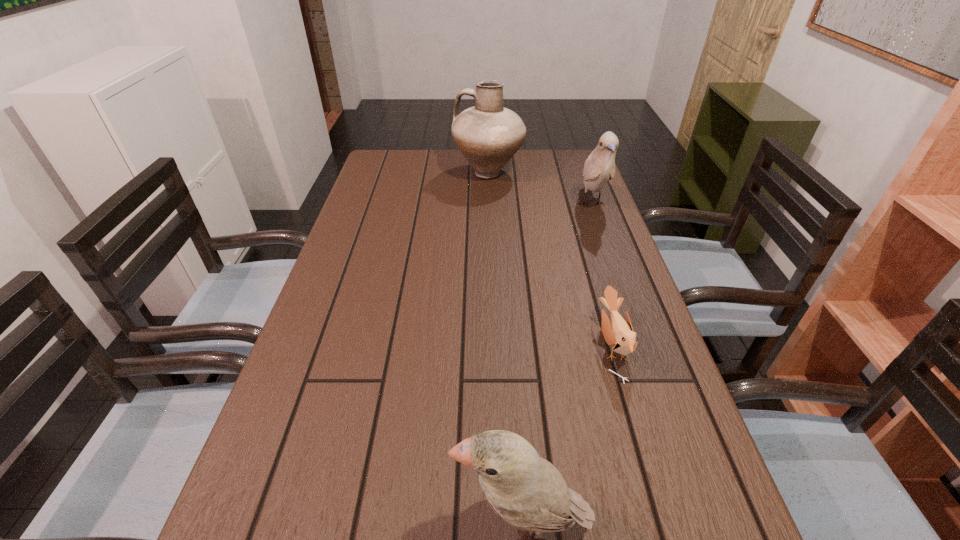
The image size is (960, 540). Find the location of `vacant point located 0.350m at the beak of the shortest object`. vacant point located 0.350m at the beak of the shortest object is located at coordinates (427, 345).

I want to click on object positioned at the far edge, so click(488, 135).

What are the coordinates of `vacant space at the far edge of the desktop` in the screenshot? It's located at (432, 161).

I want to click on vacant space at the left edge of the desktop, so click(399, 190).

Locate an element on the screen. The image size is (960, 540). vacant region at the right edge of the desktop is located at coordinates (570, 199).

Where is `vacant position at the far left corner of the desktop`? vacant position at the far left corner of the desktop is located at coordinates (386, 170).

Where is `vacant space at the far right corner`? Image resolution: width=960 pixels, height=540 pixels. vacant space at the far right corner is located at coordinates (574, 164).

Identify the location of empty space that is in between the second nearest bird and the farthest bird. The height and width of the screenshot is (540, 960). (602, 274).

Where is `vacant area between the farthest bird and the second nearest object`? This screenshot has width=960, height=540. vacant area between the farthest bird and the second nearest object is located at coordinates (602, 274).

At what (x,y) coordinates should I click in order to perform the action: click on vacant area between the second nearest bird and the farthest bird. Please return your answer as a coordinate pair (x, y). The image size is (960, 540). Looking at the image, I should click on (602, 274).